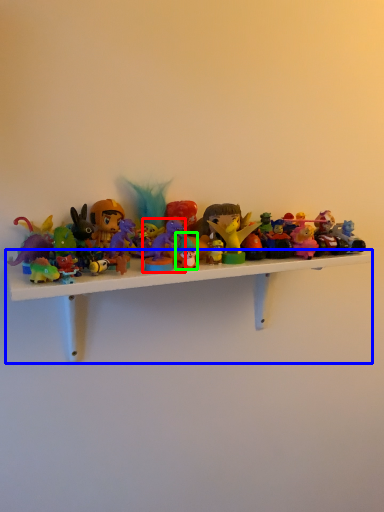
Question: Which object is positioned farthest from toy (highlighted by a red box)? Select from shelf (highlighted by a blue box) and toy (highlighted by a green box).

Choices:
 (A) shelf
 (B) toy

Answer: (A)